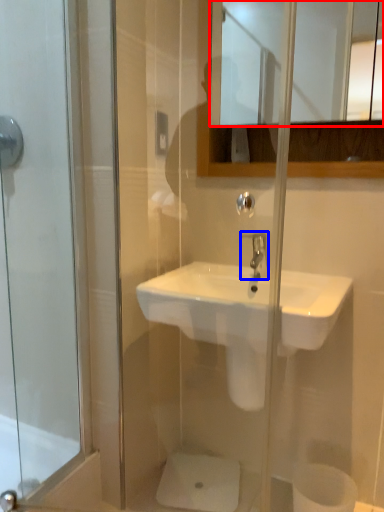
Question: Which object is closer to the camera taking this photo, mirror (highlighted by a red box) or tap (highlighted by a blue box)?

Choices:
 (A) mirror
 (B) tap

Answer: (A)